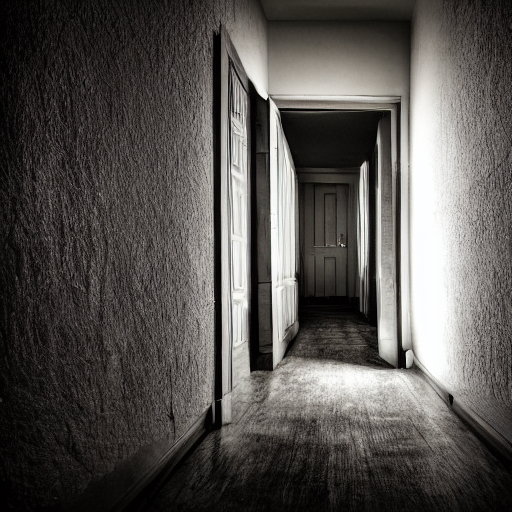
At what (x,y) coordinates should I click in order to perform the action: click on wooden floor. Please return your answer as a coordinate pair (x, y). Looking at the image, I should click on (346, 480).